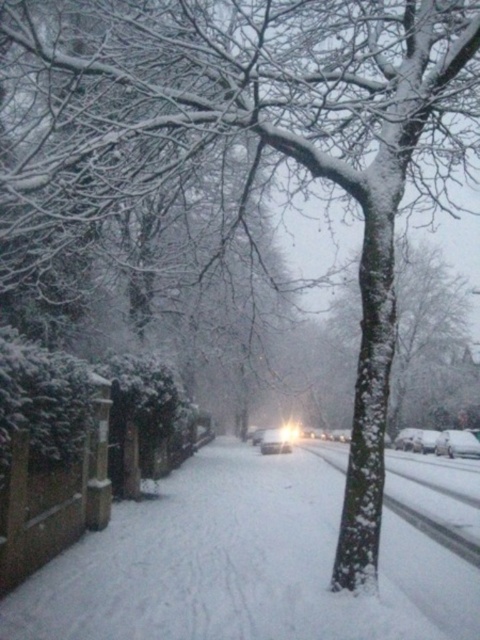
Does white fluffy snow at center have a lesser width compared to white glossy headlight at center?

In fact, white fluffy snow at center might be wider than white glossy headlight at center.

Describe the element at coordinates (241, 564) in the screenshot. I see `white fluffy snow at center` at that location.

Is point (163, 604) closer to viewer compared to point (297, 436)?

Yes, it is.

The image size is (480, 640). What are the coordinates of `white fluffy snow at center` in the screenshot? It's located at (241, 564).

Can you confirm if white matte car at center is thinner than white glossy headlight at center?

Correct, white matte car at center's width is less than white glossy headlight at center's.

Between white matte car at center and white glossy headlight at center, which one appears on the left side from the viewer's perspective?

Positioned to the left is white glossy headlight at center.

Image resolution: width=480 pixels, height=640 pixels. What are the coordinates of `white matte car at center` in the screenshot? It's located at (457, 444).

Consider the image. Between white matte car at center and white glossy car at center, which one appears on the right side from the viewer's perspective?

white matte car at center

Between point (444, 429) and point (264, 432), which one is positioned behind?

Point (444, 429)

Which is behind, point (474, 456) or point (274, 444)?

The point (474, 456) is more distant.

I want to click on white matte car at center, so click(x=457, y=444).